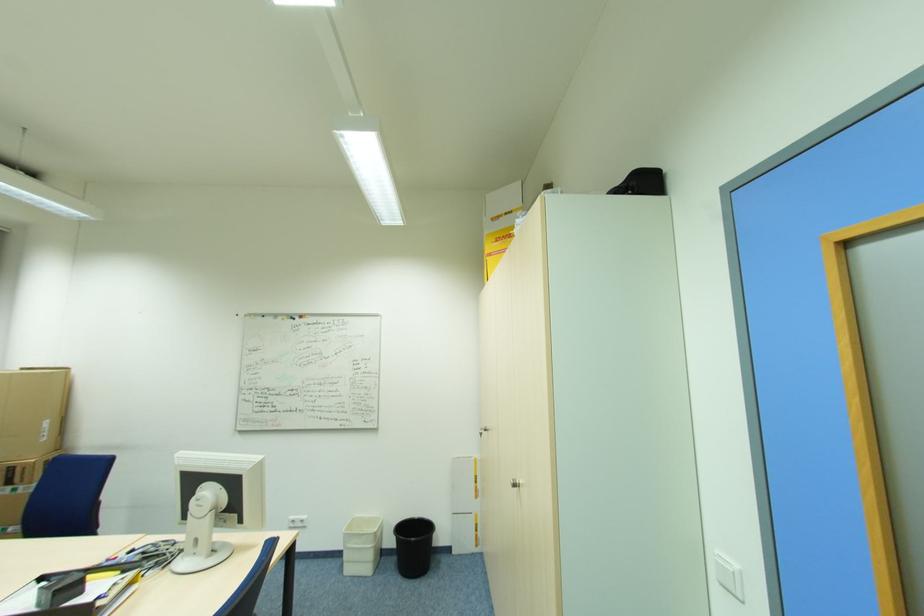
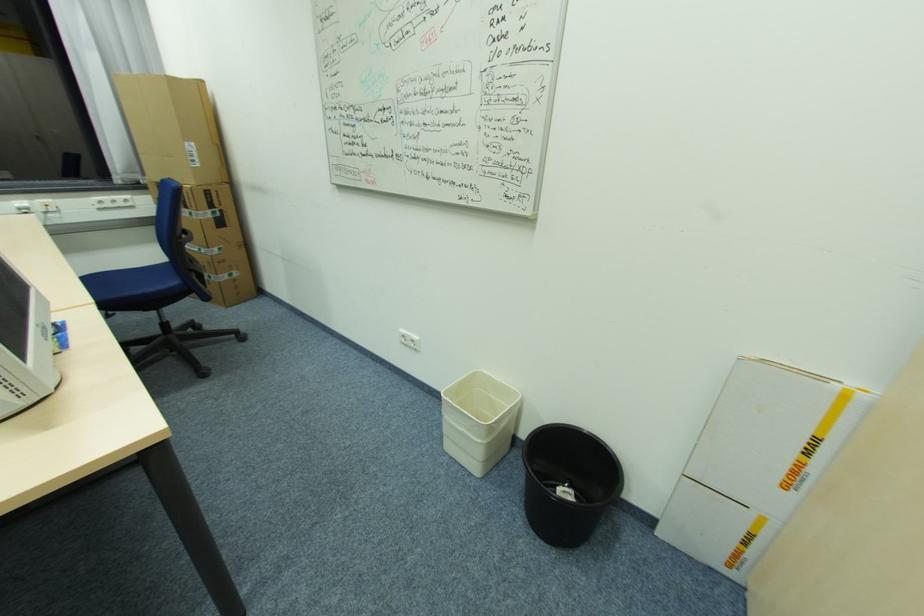
Find the pixel in the second image that matches pixel 50 435 in the first image.

(200, 161)